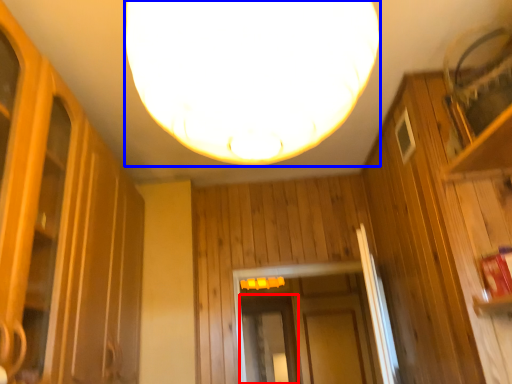
Question: Which of the following is the closest to the observer, screen door (highlighted by a red box) or lamp (highlighted by a blue box)?

Choices:
 (A) screen door
 (B) lamp

Answer: (B)